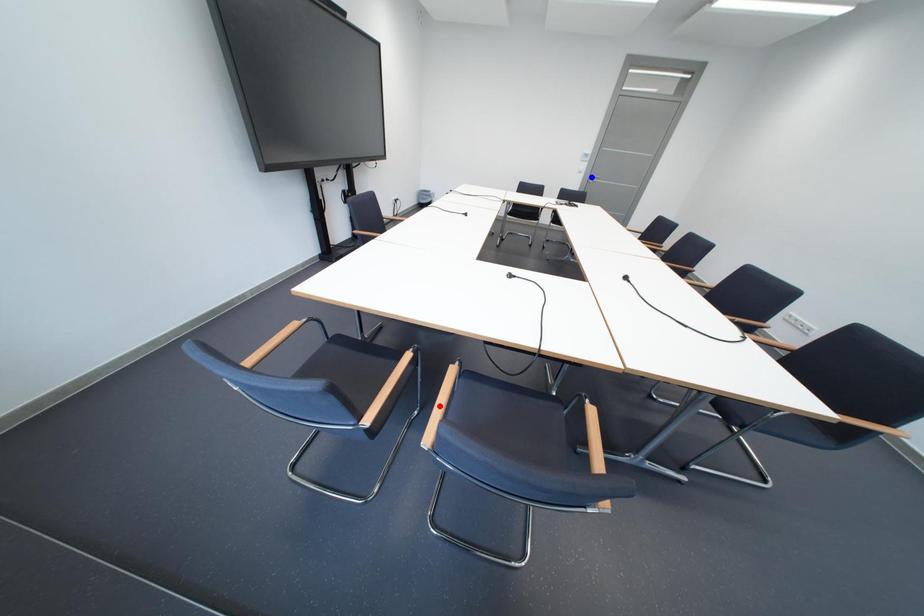
Question: Two points are marked on the image. Which point is closer to the camera?

Choices:
 (A) Blue point is closer.
 (B) Red point is closer.

Answer: (B)